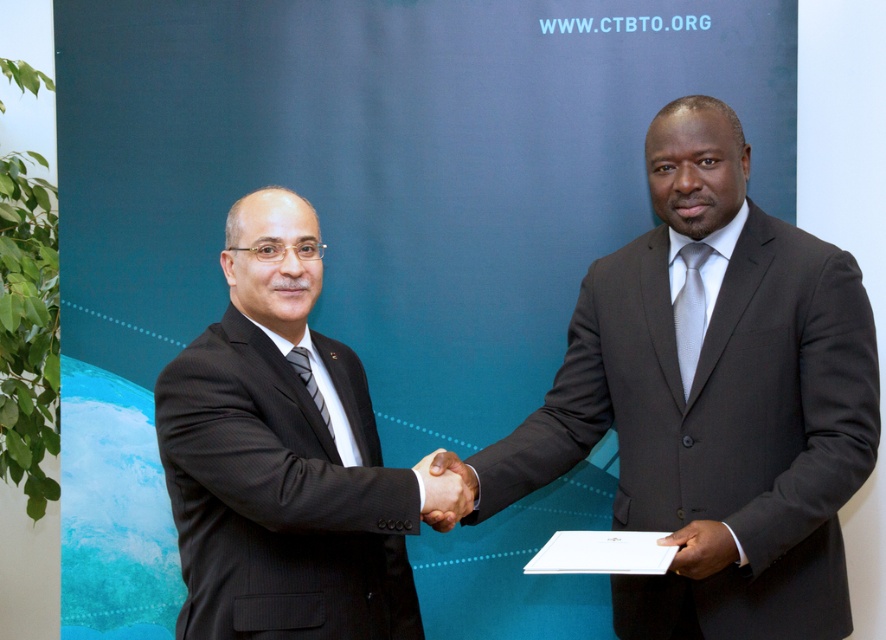
Is black suit at center thinner than smooth white paper at center?

No, black suit at center is not thinner than smooth white paper at center.

Who is lower down, black suit at center or smooth white paper at center?

smooth white paper at center

Between point (254, 589) and point (714, 544), which one is positioned behind?

The point (254, 589) is more distant.

Image resolution: width=886 pixels, height=640 pixels. In order to click on black suit at center in this screenshot , I will do [281, 456].

Is black matte hand at center positioned behind smooth white paper at center?

Yes, black matte hand at center is behind smooth white paper at center.

Is black matte hand at center shorter than smooth white paper at center?

No, black matte hand at center is not shorter than smooth white paper at center.

Who is more forward, (434,452) or (705,568)?

Point (705,568) is more forward.

This screenshot has width=886, height=640. What are the coordinates of `black matte hand at center` in the screenshot? It's located at (445, 488).

Image resolution: width=886 pixels, height=640 pixels. What do you see at coordinates (714, 396) in the screenshot? I see `dark gray suit at center` at bounding box center [714, 396].

Can you confirm if dark gray suit at center is smaller than black matte hand at center?

No.

Find the location of a particular element. This screenshot has height=640, width=886. dark gray suit at center is located at coordinates (714, 396).